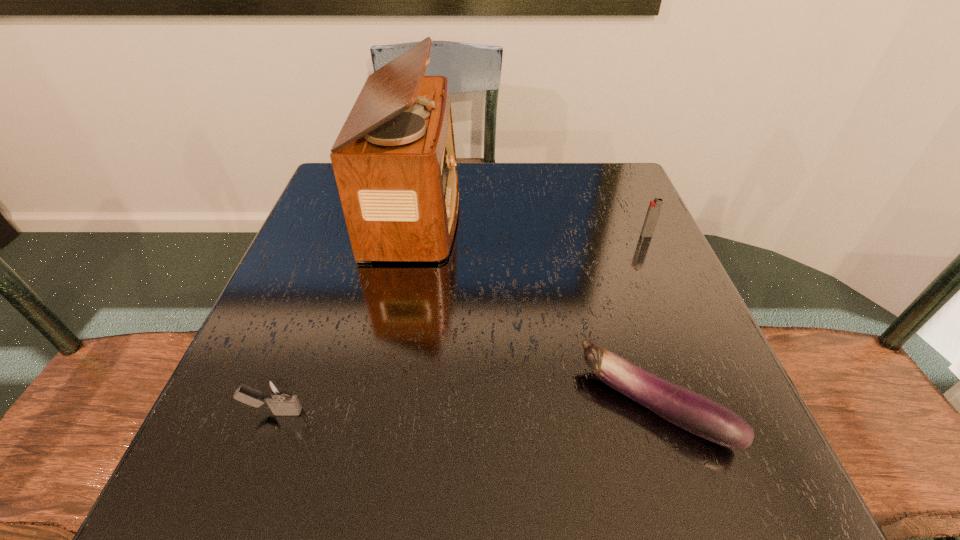
In the image, there is a desktop. Where is `free region at the left edge`? This screenshot has height=540, width=960. free region at the left edge is located at coordinates (337, 278).

Identify the location of free location at the right edge. This screenshot has height=540, width=960. (672, 308).

You are a GUI agent. You are given a task and a screenshot of the screen. Output one action in this format:
    pyautogui.click(x=<x>, y=<y>)
    Task: Click on the free location at the near left corner of the desktop
    Image resolution: width=960 pixels, height=540 pixels.
    Given the screenshot: What is the action you would take?
    pyautogui.click(x=286, y=462)

The width and height of the screenshot is (960, 540). I want to click on vacant space at the far right corner, so click(x=603, y=166).

The width and height of the screenshot is (960, 540). In order to click on free space between the third object from right to left and the eggplant in this screenshot , I will do `click(536, 308)`.

The height and width of the screenshot is (540, 960). Identify the location of vacant area that lies between the shortest object and the third object from right to left. (536, 308).

Identify the location of empty location between the eggplant and the leftmost object. This screenshot has width=960, height=540. (465, 408).

You are a GUI agent. You are given a task and a screenshot of the screen. Output one action in this format:
    pyautogui.click(x=<x>, y=<y>)
    Task: Click on the blank region between the right igniter and the radio receiver
    The image size is (960, 540).
    Given the screenshot: What is the action you would take?
    pyautogui.click(x=531, y=223)

Find the location of a particular element. blank region between the shortest object and the radio receiver is located at coordinates (536, 308).

Where is `vacant area that lies between the nearer igniter and the farther igniter`? vacant area that lies between the nearer igniter and the farther igniter is located at coordinates (460, 323).